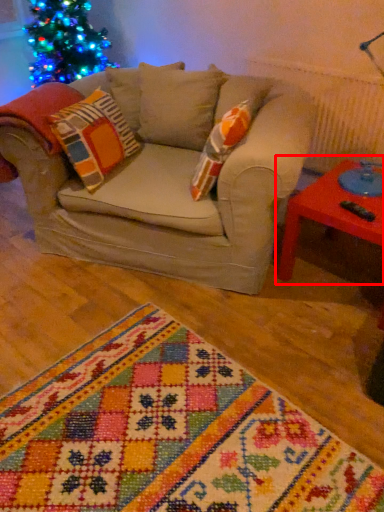
Question: Observing the image, what is the correct spatial positioning of table (annotated by the red box) in reference to blanket?

Choices:
 (A) right
 (B) left

Answer: (A)